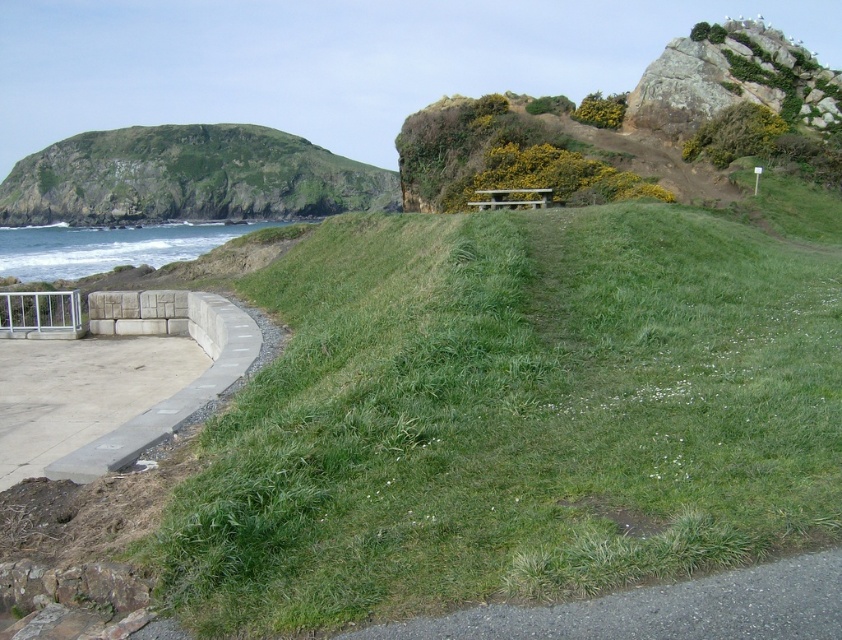
Question: Considering the relative positions of white metallic rail at left and light brown wooden bench at center in the image provided, where is white metallic rail at left located with respect to light brown wooden bench at center?

Choices:
 (A) right
 (B) left

Answer: (B)

Question: Does white metallic rail at left come behind light brown wooden bench at center?

Choices:
 (A) yes
 (B) no

Answer: (B)

Question: Among these points, which one is farthest from the camera?

Choices:
 (A) (507, 204)
 (B) (328, 624)
 (C) (105, 204)

Answer: (C)

Question: Can you confirm if gray asphalt path at lower right is positioned to the left of light brown wooden bench at center?

Choices:
 (A) no
 (B) yes

Answer: (B)

Question: Which object appears closest to the camera in this image?

Choices:
 (A) gray asphalt path at lower right
 (B) light brown wooden bench at center

Answer: (A)

Question: Which point is farther from the camera taking this photo?

Choices:
 (A) (514, 205)
 (B) (467, 284)
 (C) (81, 220)

Answer: (C)